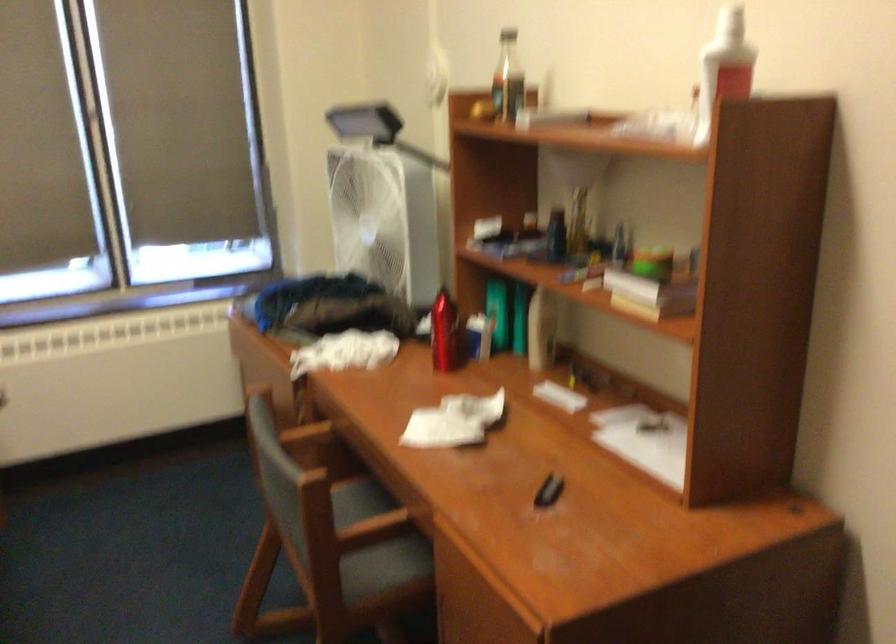
Where is `chair armrest`? Image resolution: width=896 pixels, height=644 pixels. chair armrest is located at coordinates (306, 435).